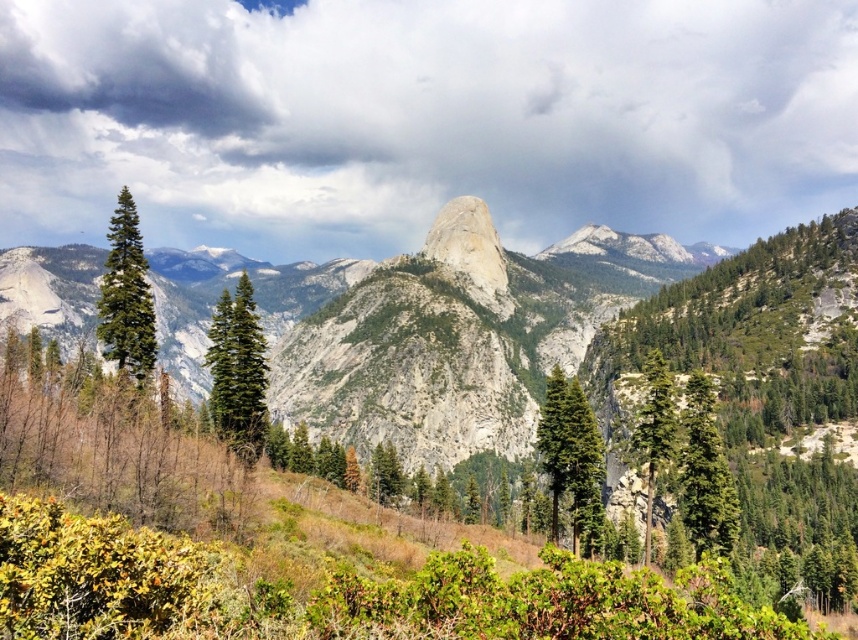
Question: Where is rocky gray mountain at center located in relation to green matte tree at center in the image?

Choices:
 (A) below
 (B) above

Answer: (B)

Question: Estimate the real-world distances between objects in this image. Which object is closer to the rocky gray mountain at center?

Choices:
 (A) green matte tree at left
 (B) green matte tree at center-left
 (C) green rough bark tree at center-right

Answer: (C)

Question: Is green matte tree at center-right positioned in front of green rough bark tree at center-right?

Choices:
 (A) no
 (B) yes

Answer: (B)

Question: Is green matte tree at center closer to camera compared to green rough bark tree at center-right?

Choices:
 (A) no
 (B) yes

Answer: (A)

Question: Which object is farther from the camera taking this photo?

Choices:
 (A) green matte tree at left
 (B) green matte tree at center
 (C) green matte tree at center-right
 (D) green matte tree at center-left

Answer: (B)

Question: Which of these objects is positioned farthest from the green rough bark tree at center-right?

Choices:
 (A) green matte tree at left
 (B) rocky gray mountain at center

Answer: (B)